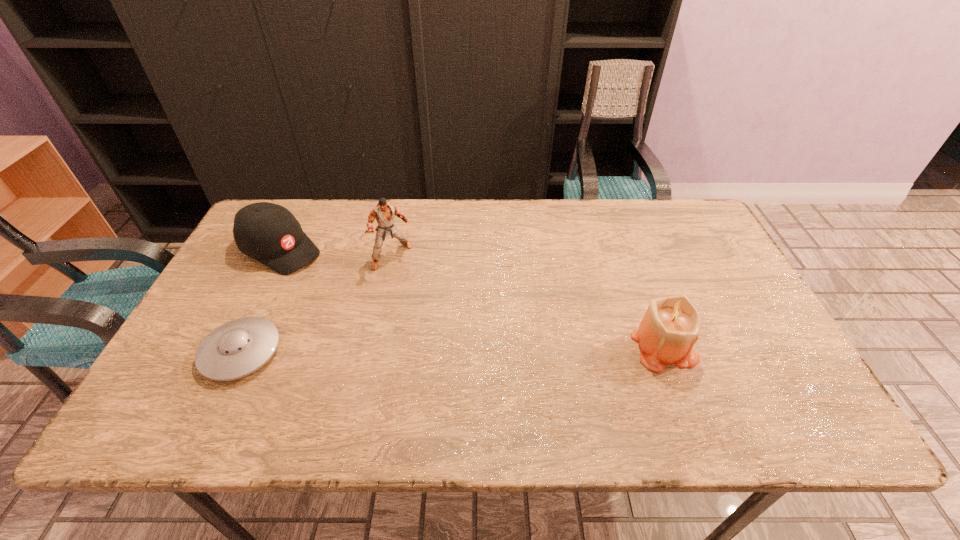
Identify the location of vacant space on the desktop that is between the shortest object and the third shortest object and is positioned on the front-facing side of the second object from right to left. (469, 348).

Image resolution: width=960 pixels, height=540 pixels. In order to click on vacant spot on the desktop that is between the saucer and the candle and is positioned with a logo on the front of the second shortest object in this screenshot , I will do `click(447, 349)`.